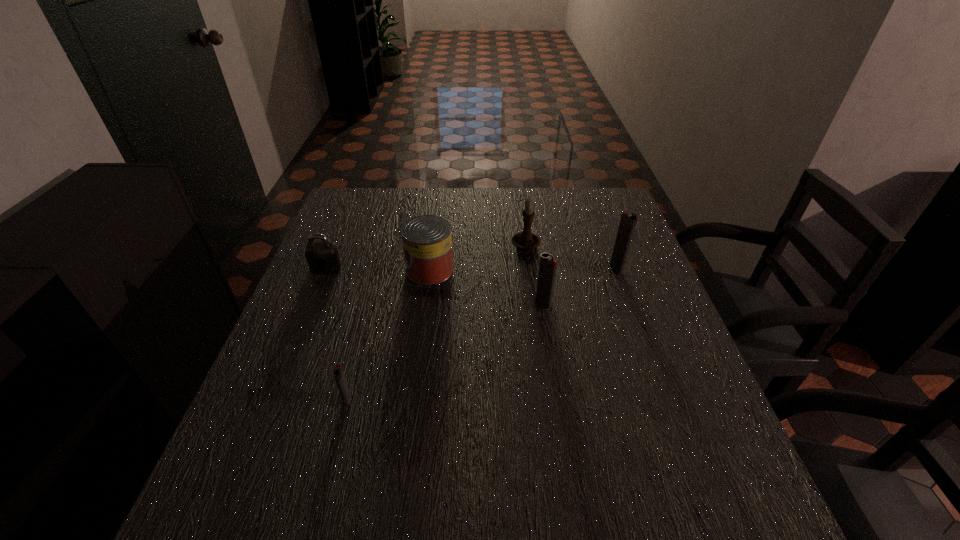
This screenshot has width=960, height=540. Find the location of `vacant space at the right edge of the desktop`. vacant space at the right edge of the desktop is located at coordinates (612, 309).

I want to click on vacant space at the far left corner of the desktop, so click(360, 225).

Find the location of a particular element. Image resolution: width=960 pixels, height=540 pixels. vacant space at the near left corner of the desktop is located at coordinates (284, 433).

The image size is (960, 540). In the image, there is a desktop. In order to click on blank space at the far right corner in this screenshot , I will do `click(612, 193)`.

You are a GUI agent. You are given a task and a screenshot of the screen. Output one action in this format:
    pyautogui.click(x=<x>, y=<y>)
    Task: Click on the empty location between the candle holder and the rightmost object
    
    Given the screenshot: What is the action you would take?
    pyautogui.click(x=571, y=257)

Where is `vacant area that lies between the fifth object from right to left and the rightmost igniter`? The image size is (960, 540). vacant area that lies between the fifth object from right to left and the rightmost igniter is located at coordinates (x=482, y=334).

Identify the location of vacant space that is in between the padlock and the rightmost object. (471, 268).

This screenshot has width=960, height=540. Identify the location of free point between the second nearest object and the farthest igniter. (580, 286).

In order to click on free space between the rightmost object and the second shortest igniter in this screenshot , I will do `click(580, 286)`.

This screenshot has height=540, width=960. Identify the location of free space between the rightmost object and the second object from left to right. (482, 334).